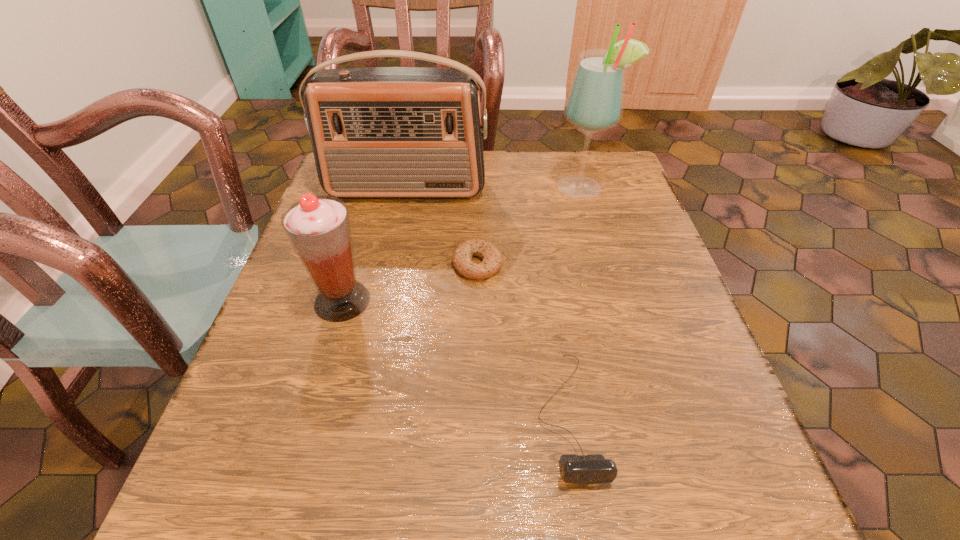
Where is `blank space located on the front-facing side of the nearest object`? blank space located on the front-facing side of the nearest object is located at coordinates (586, 530).

The height and width of the screenshot is (540, 960). Find the location of `vacant region located on the back of the bagel`. vacant region located on the back of the bagel is located at coordinates (477, 203).

Where is `alcohol located at the far edge`? Image resolution: width=960 pixels, height=540 pixels. alcohol located at the far edge is located at coordinates (595, 101).

Where is `radio receiver present at the far edge`? This screenshot has width=960, height=540. radio receiver present at the far edge is located at coordinates (380, 132).

In order to click on object present at the near edge in this screenshot , I will do `click(592, 468)`.

You are a GUI agent. You are given a task and a screenshot of the screen. Output one action in this format:
    pyautogui.click(x=<x>, y=<y>)
    Task: Click on the radio receiver at the left edge
    
    Given the screenshot: What is the action you would take?
    pyautogui.click(x=380, y=132)

You are a GUI agent. You are given a task and a screenshot of the screen. Output one action in this format:
    pyautogui.click(x=<x>, y=<y>)
    Task: Click on the smoothie that is at the left edge
    The width and height of the screenshot is (960, 540).
    Given the screenshot: What is the action you would take?
    pyautogui.click(x=318, y=227)

Find the location of a particular element. Image resolution: width=960 pixels, height=540 pixels. object at the right edge is located at coordinates (595, 101).

Locate an element on the screen. This screenshot has height=540, width=960. object situated at the far left corner is located at coordinates (380, 132).

Identify the location of object at the far right corner. tap(595, 101).